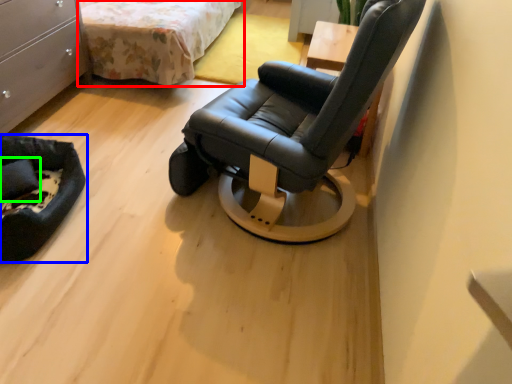
Question: Which object is the closest to the bed (highlighted by a red box)? Choose among these: furniture (highlighted by a blue box) or pillow (highlighted by a green box).

Choices:
 (A) furniture
 (B) pillow

Answer: (A)